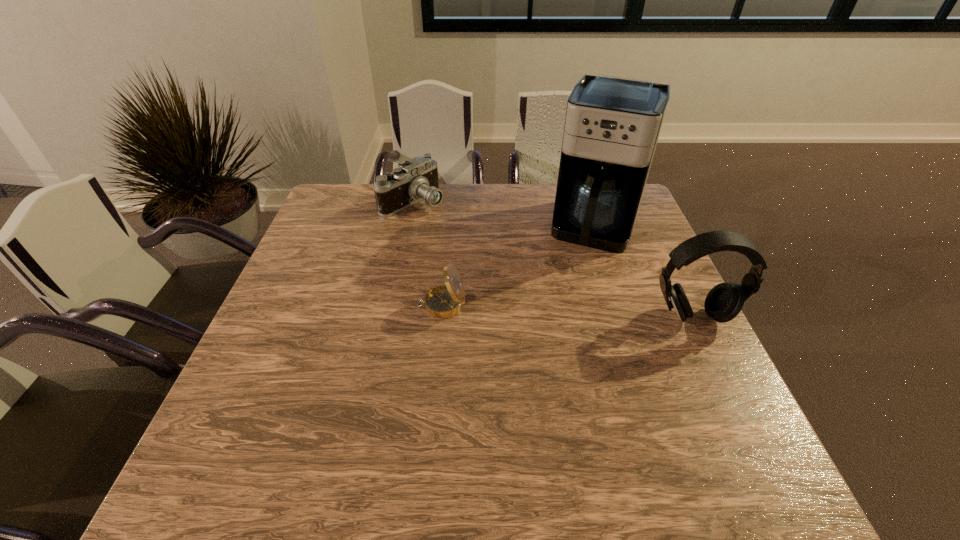
Find the location of a particular element. The width and height of the screenshot is (960, 540). compass is located at coordinates (445, 301).

Find the location of a particular element. Image resolution: width=960 pixels, height=540 pixels. the second tallest object is located at coordinates (724, 301).

Locate an element on the screen. The height and width of the screenshot is (540, 960). camera is located at coordinates (415, 180).

Where is `the tallest object`? the tallest object is located at coordinates (612, 125).

Image resolution: width=960 pixels, height=540 pixels. What are the coordinates of `free location located with the dial facing the compass` in the screenshot? It's located at (365, 305).

The height and width of the screenshot is (540, 960). I want to click on vacant position located with the dial facing the compass, so click(x=303, y=305).

You are a GUI agent. You are given a task and a screenshot of the screen. Output one action in this format:
    pyautogui.click(x=<x>, y=<y>)
    Task: Click on the vacant space located with the dial facing the compass
    
    Given the screenshot: What is the action you would take?
    click(397, 305)

You are a GUI agent. You are given a task and a screenshot of the screen. Output one action in this format:
    pyautogui.click(x=<x>, y=<y>)
    Task: Click on the vacant space located 0.140m on the ear cups of the second tallest object
    
    Given the screenshot: What is the action you would take?
    pyautogui.click(x=725, y=382)

Where is `vacant region located at the lens of the camera`? This screenshot has height=540, width=960. vacant region located at the lens of the camera is located at coordinates (516, 282).

Where is `blank space located at the lens of the camera`? The width and height of the screenshot is (960, 540). blank space located at the lens of the camera is located at coordinates (506, 274).